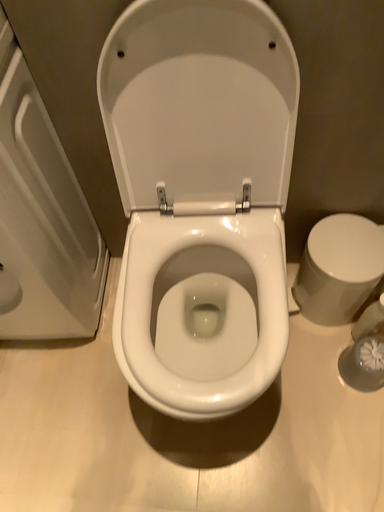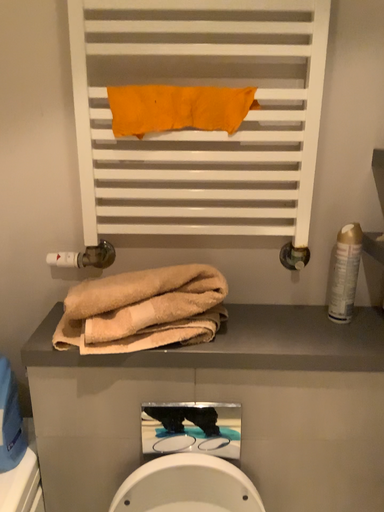
Question: How did the camera likely rotate when shooting the video?

Choices:
 (A) rotated downward
 (B) rotated upward

Answer: (B)